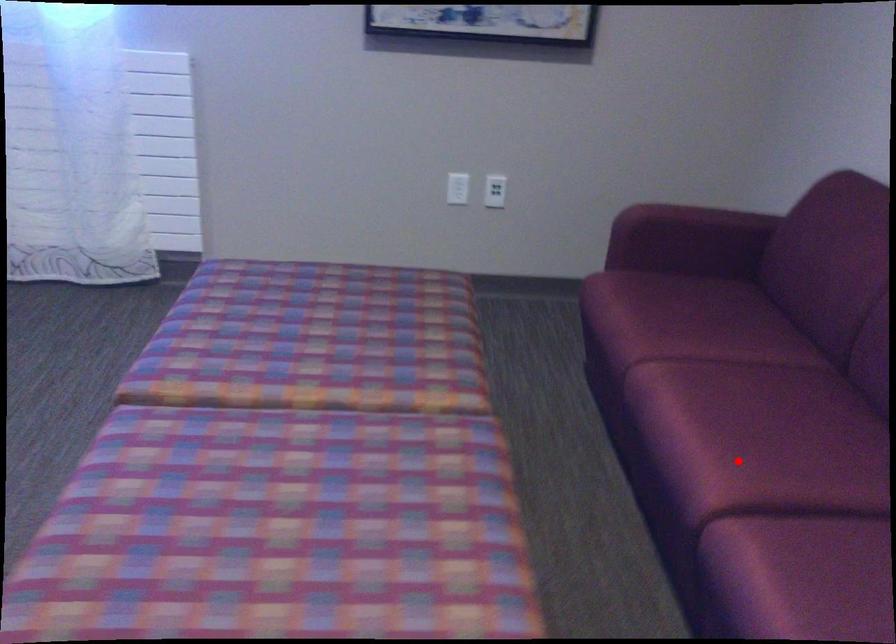
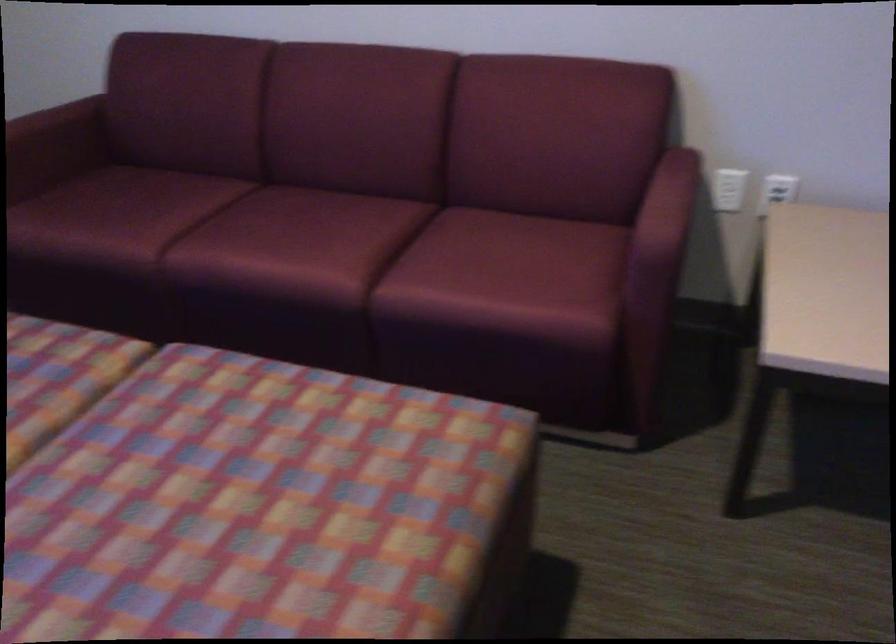
Question: A red point is marked in image1. In image2, is the corresponding 3D point closer to the camera or farther? Reply with the corresponding letter.

Choices:
 (A) The corresponding 3D point is closer.
 (B) The corresponding 3D point is farther.

Answer: (B)